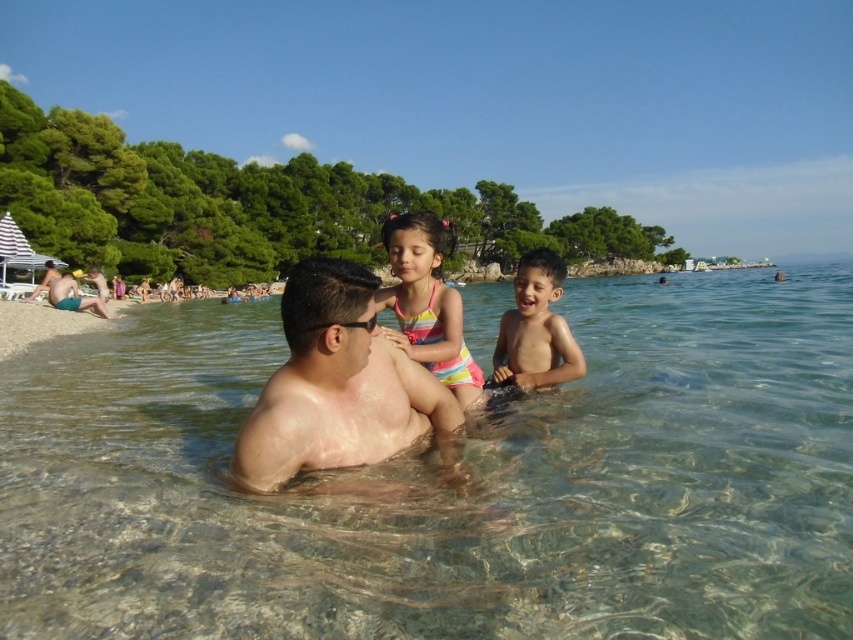
Question: Is smooth skin man at center to the left of smooth skin boy at center from the viewer's perspective?

Choices:
 (A) yes
 (B) no

Answer: (A)

Question: Does clear water at center appear over smooth sand beach at lower left?

Choices:
 (A) no
 (B) yes

Answer: (B)

Question: Is clear water at center smaller than matte blue shorts at left?

Choices:
 (A) no
 (B) yes

Answer: (A)

Question: Estimate the real-world distances between objects in this image. Which object is closer to the striped swimsuit at center?

Choices:
 (A) smooth skin man at center
 (B) smooth tan skin at center
 (C) matte blue shorts at left
 (D) smooth skin boy at center

Answer: (A)

Question: Estimate the real-world distances between objects in this image. Which object is closer to the clear water at center?

Choices:
 (A) smooth skin man at center
 (B) striped swimsuit at center
 (C) smooth sand beach at lower left
 (D) smooth skin boy at center

Answer: (A)

Question: Based on their relative distances, which object is nearer to the matte blue shorts at left?

Choices:
 (A) smooth skin man at center
 (B) clear water at center

Answer: (B)